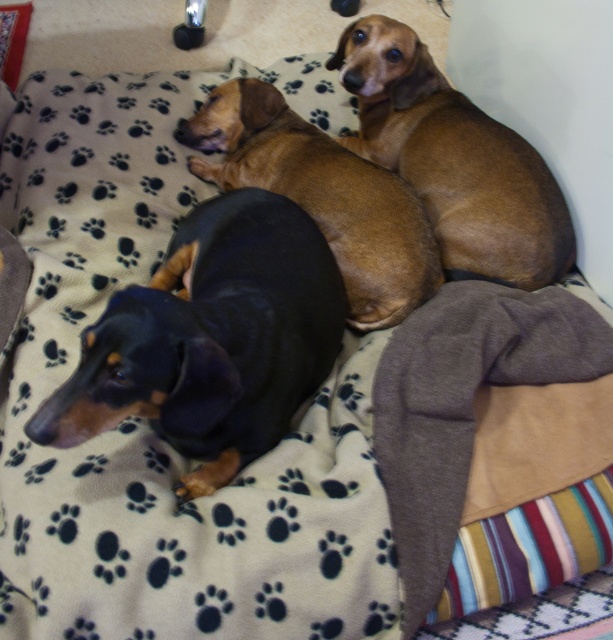
Question: Considering the relative positions of black smooth dog at left and brown smooth dog at upper center in the image provided, where is black smooth dog at left located with respect to brown smooth dog at upper center?

Choices:
 (A) above
 (B) below

Answer: (B)

Question: In this image, where is brown smooth dog at upper right located relative to brown smooth dog at upper center?

Choices:
 (A) right
 (B) left

Answer: (A)

Question: Which object is the farthest from the brown smooth dog at upper right?

Choices:
 (A) brown smooth dog at upper center
 (B) black smooth dog at left

Answer: (B)

Question: Which object is closer to the camera taking this photo?

Choices:
 (A) black smooth dog at left
 (B) brown smooth dog at upper center

Answer: (A)

Question: Does black smooth dog at left have a lesser width compared to brown smooth dog at upper right?

Choices:
 (A) no
 (B) yes

Answer: (B)

Question: Which point is closer to the camera?

Choices:
 (A) brown smooth dog at upper right
 (B) brown smooth dog at upper center
 (C) black smooth dog at left

Answer: (C)